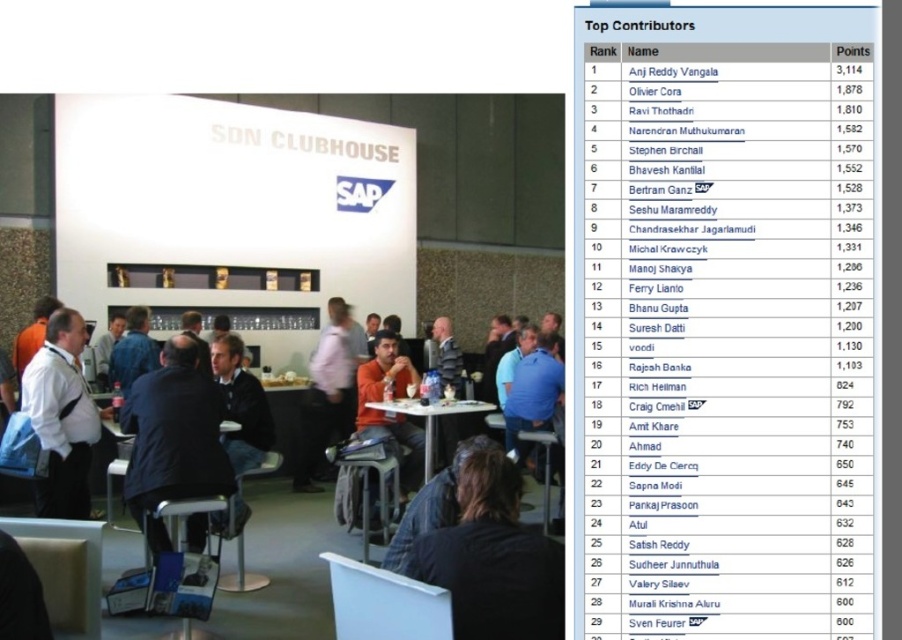
Question: Is dark brown leather jacket at lower center thinner than white shirt at left?

Choices:
 (A) yes
 (B) no

Answer: (B)

Question: Which point is farther from the camera taking this photo?

Choices:
 (A) (106, 502)
 (B) (408, 422)
 (C) (150, 408)
 (D) (330, 358)

Answer: (D)

Question: In this image, where is dark brown leather jacket at lower center located relative to dark blue sweater at center?

Choices:
 (A) below
 (B) above

Answer: (B)

Question: Which object is farther from the camera taking this photo?

Choices:
 (A) orange matte shirt at center
 (B) white plastic table at center

Answer: (A)

Question: Estimate the real-world distances between objects in this image. Which object is closer to the dark blue suit at center?

Choices:
 (A) white plastic table at center
 (B) orange matte shirt at center
 (C) dark brown leather jacket at lower center

Answer: (B)

Question: Observing the image, what is the correct spatial positioning of white shirt at left in reference to matte black table at center?

Choices:
 (A) left
 (B) right

Answer: (B)